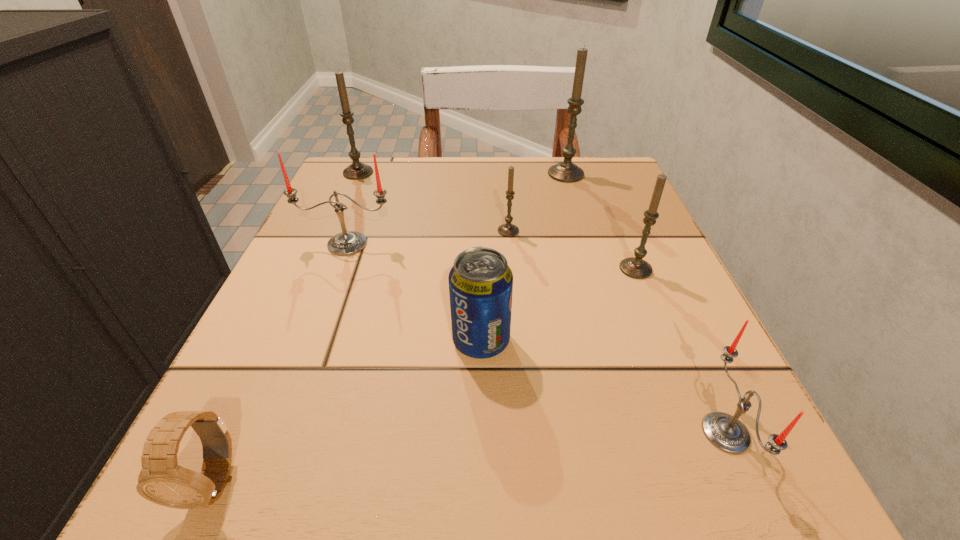
You are a GUI agent. You are given a task and a screenshot of the screen. Output one action in this format:
    pyautogui.click(x=<x>, y=<y>)
    Task: Click on the third farthest gray candle
    Image resolution: width=960 pixels, height=540 pixels.
    Given the screenshot: What is the action you would take?
    pyautogui.click(x=508, y=230)

Find the location of a particular element. This screenshot has height=540, width=960. the right red candle is located at coordinates (724, 431).

Identify the location of the nearest candle. (724, 431).

Where is `watch`? This screenshot has height=540, width=960. watch is located at coordinates (161, 480).

Image resolution: width=960 pixels, height=540 pixels. What are the coordinates of `free location located 0.360m on the left of the third object from right to left` in the screenshot? It's located at (390, 174).

Locate an element on the screen. This screenshot has width=960, height=540. free space located on the front of the third smallest gray candle is located at coordinates (317, 269).

Where is `vacant space positioned on the front-facing side of the left red candle`? The height and width of the screenshot is (540, 960). vacant space positioned on the front-facing side of the left red candle is located at coordinates (326, 299).

The image size is (960, 540). In order to click on free location located on the left of the fifth farthest candle in this screenshot , I will do `click(444, 269)`.

Where is `vacant space located 0.180m on the right of the soda`? The height and width of the screenshot is (540, 960). vacant space located 0.180m on the right of the soda is located at coordinates (636, 341).

The width and height of the screenshot is (960, 540). I want to click on vacant point located 0.160m on the front of the third farthest gray candle, so click(x=514, y=296).